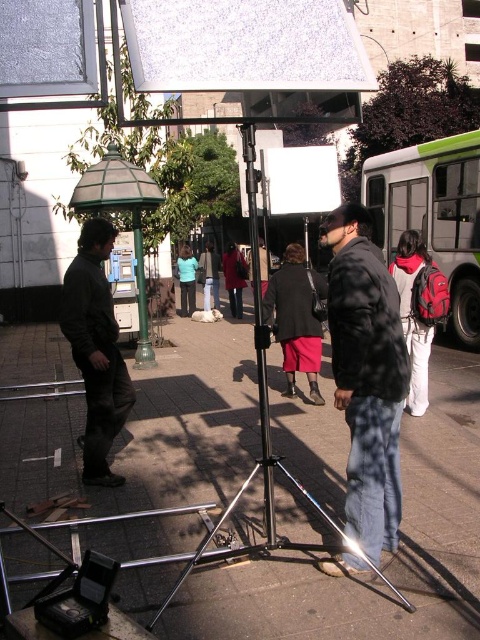
Question: Does red backpack at right appear over black plastic device at lower left?

Choices:
 (A) yes
 (B) no

Answer: (A)

Question: Which object is closer to the camera taking this photo?

Choices:
 (A) green matte pole at center-left
 (B) green matte bus at right
 (C) black matte jacket at center
 (D) red backpack at right

Answer: (C)

Question: Observing the image, what is the correct spatial positioning of red backpack at right in reference to red wool coat at center?

Choices:
 (A) above
 (B) below

Answer: (B)

Question: Among these objects, which one is nearest to the camera?

Choices:
 (A) red backpack at right
 (B) matte teal shirt at center

Answer: (A)

Question: Considering the real-world distances, which object is closest to the red wool coat at center?

Choices:
 (A) matte black coat at center
 (B) matte black jacket at center
 (C) red backpack at right

Answer: (B)

Question: Is dark green jacket at left positioned in front of white plastic tripod at center?

Choices:
 (A) yes
 (B) no

Answer: (B)